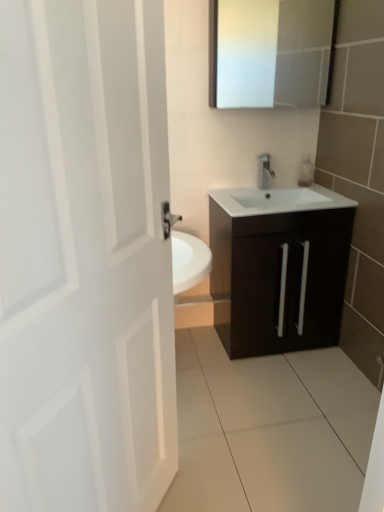
Question: Does satin nickel faucet at center appear on the right side of white matte door at left?

Choices:
 (A) no
 (B) yes

Answer: (B)

Question: Does satin nickel faucet at center lie in front of white matte door at left?

Choices:
 (A) yes
 (B) no

Answer: (B)

Question: From the image's perspective, is satin nickel faucet at center below white matte door at left?

Choices:
 (A) yes
 (B) no

Answer: (B)

Question: Is satin nickel faucet at center aimed at white matte door at left?

Choices:
 (A) yes
 (B) no

Answer: (B)

Question: Is satin nickel faucet at center far away from white matte door at left?

Choices:
 (A) no
 (B) yes

Answer: (B)

Question: Is satin nickel faucet at center to the left of white matte door at left from the viewer's perspective?

Choices:
 (A) no
 (B) yes

Answer: (A)

Question: Is white glossy medicine cabinet at upper center located outside matte dark brown cabinet at center?

Choices:
 (A) no
 (B) yes

Answer: (B)

Question: Is white glossy medicine cabinet at upper center positioned with its back to matte dark brown cabinet at center?

Choices:
 (A) no
 (B) yes

Answer: (A)

Question: Is white glossy medicine cabinet at upper center not near matte dark brown cabinet at center?

Choices:
 (A) no
 (B) yes

Answer: (A)

Question: Can you confirm if white glossy medicine cabinet at upper center is thinner than matte dark brown cabinet at center?

Choices:
 (A) yes
 (B) no

Answer: (A)

Question: From a real-world perspective, is white glossy medicine cabinet at upper center positioned under matte dark brown cabinet at center based on gravity?

Choices:
 (A) yes
 (B) no

Answer: (B)

Question: Considering the relative sizes of white glossy medicine cabinet at upper center and matte dark brown cabinet at center in the image provided, is white glossy medicine cabinet at upper center bigger than matte dark brown cabinet at center?

Choices:
 (A) yes
 (B) no

Answer: (B)

Question: From the image's perspective, is satin nickel faucet at center above white glossy medicine cabinet at upper center?

Choices:
 (A) yes
 (B) no

Answer: (B)